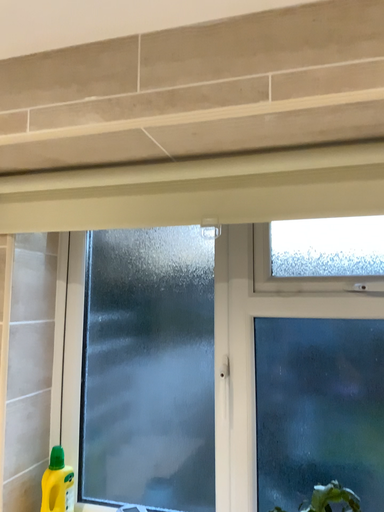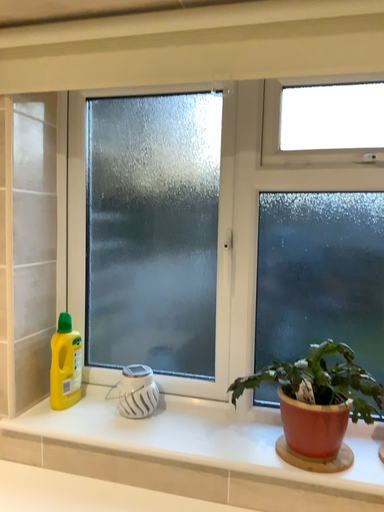
Question: How did the camera likely rotate when shooting the video?

Choices:
 (A) rotated upward
 (B) rotated downward

Answer: (B)